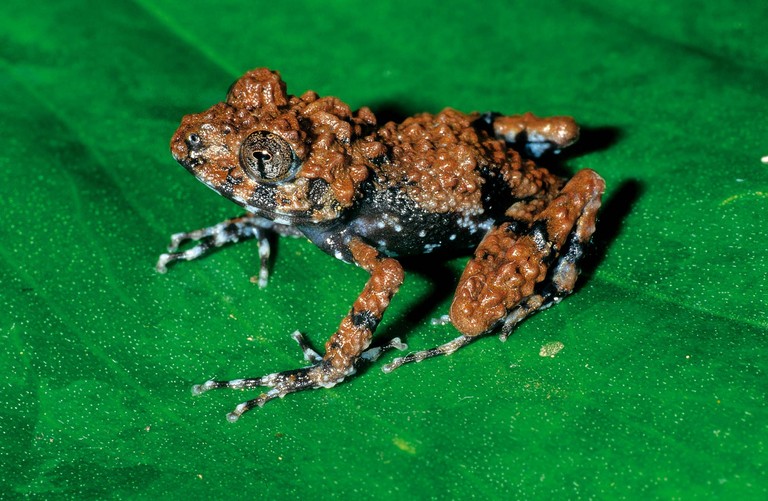
Locate an element on the screen. scales is located at coordinates (432, 158).